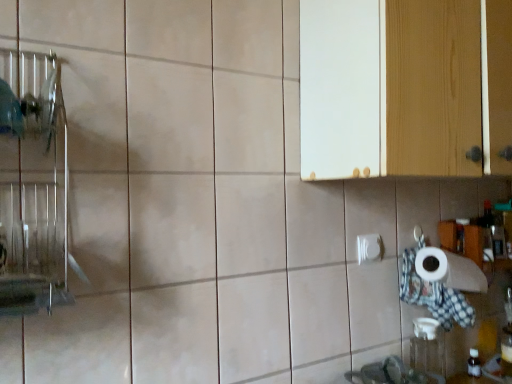
Question: In the image, is white glossy toilet paper at lower right positioned in front of or behind white wood cabinet at upper right?

Choices:
 (A) front
 (B) behind

Answer: (B)

Question: From the image's perspective, is white glossy toilet paper at lower right above or below white wood cabinet at upper right?

Choices:
 (A) below
 (B) above

Answer: (A)

Question: Is point (378, 244) positioned closer to the camera than point (376, 86)?

Choices:
 (A) closer
 (B) farther

Answer: (B)

Question: Is white wood cabinet at upper right wider or thinner than white glossy toilet paper at lower right?

Choices:
 (A) wide
 (B) thin

Answer: (A)

Question: Would you say white wood cabinet at upper right is inside or outside white glossy toilet paper at lower right?

Choices:
 (A) outside
 (B) inside

Answer: (A)

Question: From a real-world perspective, is white wood cabinet at upper right physically located above or below white glossy toilet paper at lower right?

Choices:
 (A) above
 (B) below

Answer: (A)

Question: Is white wood cabinet at upper right to the left or to the right of white glossy toilet paper at lower right in the image?

Choices:
 (A) left
 (B) right

Answer: (B)